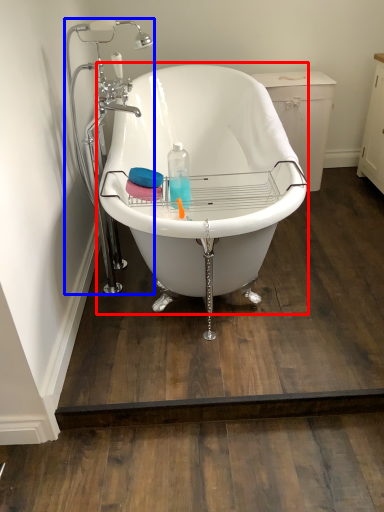
Question: Which object appears closest to the camera in this image, bathtub (highlighted by a red box) or faucet (highlighted by a blue box)?

Choices:
 (A) bathtub
 (B) faucet

Answer: (A)